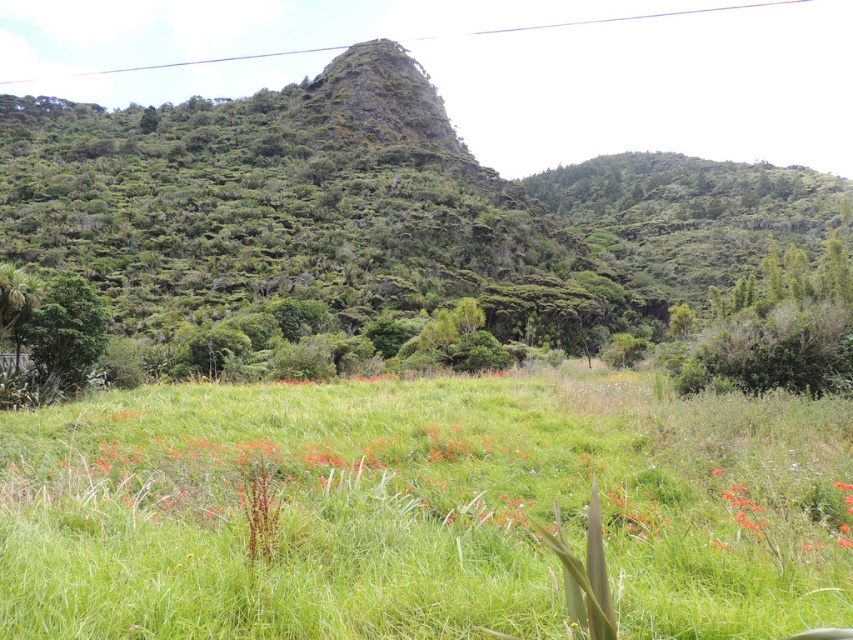
Question: Which is nearer to the green leafy tree at left?

Choices:
 (A) green textured hill at upper center
 (B) green grassy field at center

Answer: (B)

Question: Which point is closer to the camera?

Choices:
 (A) green grassy field at center
 (B) green textured hill at upper center

Answer: (A)

Question: Is green grassy field at center bigger than green leafy tree at left?

Choices:
 (A) yes
 (B) no

Answer: (A)

Question: Does green grassy field at center have a greater width compared to green leafy tree at left?

Choices:
 (A) no
 (B) yes

Answer: (B)

Question: Estimate the real-world distances between objects in this image. Which object is farther from the green textured hill at upper center?

Choices:
 (A) green grassy field at center
 (B) green leafy tree at left

Answer: (B)

Question: Considering the relative positions of green textured hill at upper center and green leafy tree at left in the image provided, where is green textured hill at upper center located with respect to green leafy tree at left?

Choices:
 (A) below
 (B) above

Answer: (B)